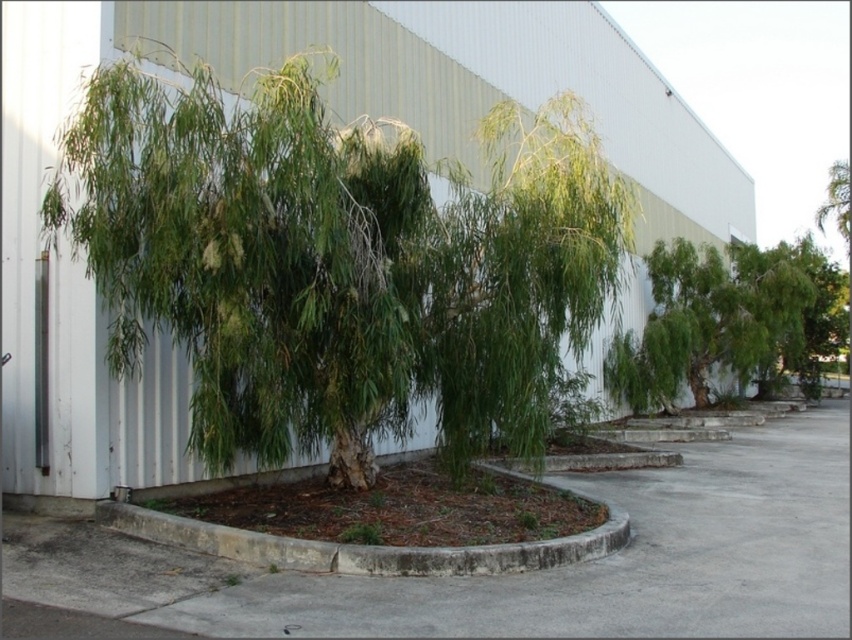
You are standing in the outdoor area and want to take a photo of the green leafy willow at center without the green leafy shrub at center appearing in the background. Is this possible based on their positions?

Yes, the green leafy willow at center is in front of the green leafy shrub at center, so you can position yourself so that the willow blocks the shrub from view.

You are standing in front of the industrial building and looking at the weeping willow tree. There are two points marked on the tree trunk. Which of the two points, point (689, 602) or point (643, 333), is closer to you?

Point (689, 602) is closer to you than point (643, 333).

Looking at this image, you are standing at the base of the large weeping willow tree and want to walk to the gray concrete pavement at center. According to the coordinates provided, in which direction should you walk?

The gray concrete pavement at center is located at coordinates point (527, 572), so you should walk towards the center of the image to reach it.